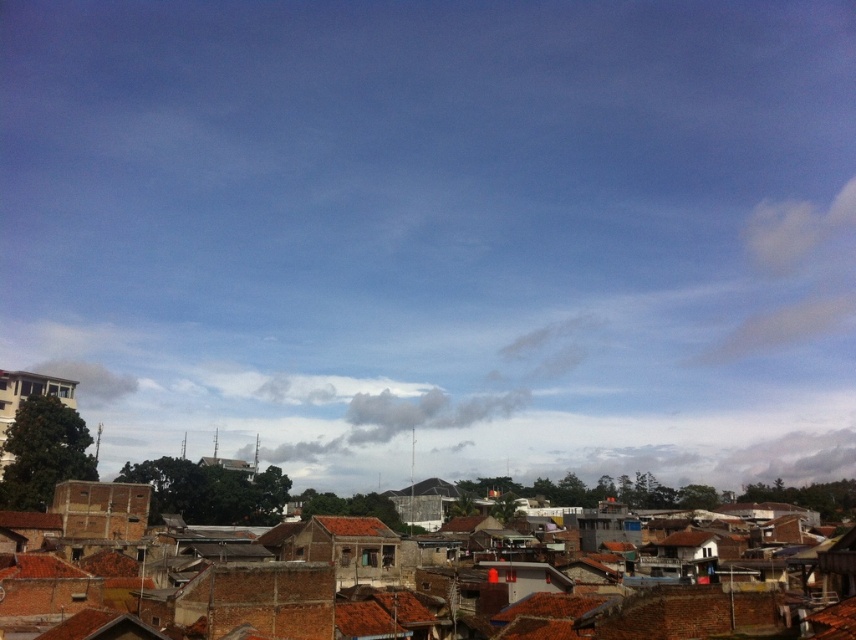
Does brown clay rooftops at center lie in front of brown tile roof at center?

No, it is not.

Is brown clay rooftops at center below brown tile roof at center?

Correct, brown clay rooftops at center is located below brown tile roof at center.

Where is `brown clay rooftops at center`? brown clay rooftops at center is located at coordinates (238, 493).